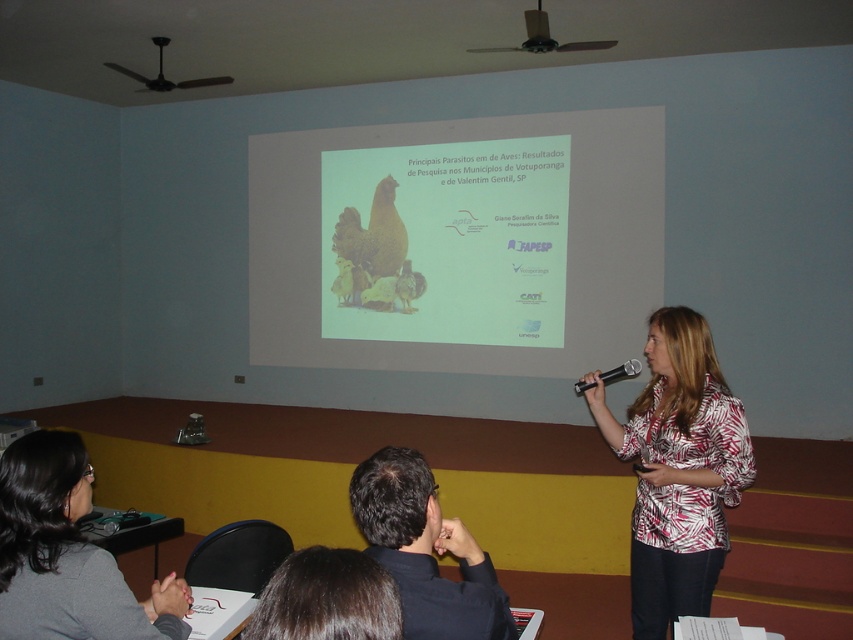
Question: Does white printed blouse at center have a larger size compared to gray fabric at lower left?

Choices:
 (A) no
 (B) yes

Answer: (B)

Question: Which object appears closest to the camera in this image?

Choices:
 (A) black matte shirt at lower center
 (B) white printed blouse at center

Answer: (A)

Question: Is white printed blouse at center bigger than gray fabric at lower left?

Choices:
 (A) yes
 (B) no

Answer: (A)

Question: Based on their relative distances, which object is farther from the black matte shirt at lower center?

Choices:
 (A) metallic projector at upper center
 (B) gray fabric at lower left
 (C) white printed blouse at center

Answer: (A)

Question: Does white printed blouse at center have a larger size compared to metallic projector at upper center?

Choices:
 (A) no
 (B) yes

Answer: (B)

Question: Which of the following is the farthest from the observer?

Choices:
 (A) matte white screen at center
 (B) gray fabric at lower left
 (C) white printed blouse at center
 (D) black matte shirt at lower center

Answer: (A)